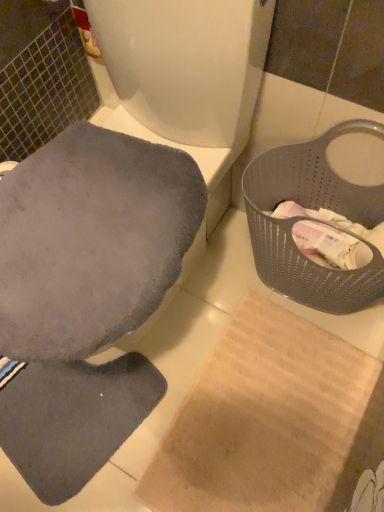
Question: From the image's perspective, is gray perforated basket at right on gray soft fabric toilet seat at upper left?

Choices:
 (A) no
 (B) yes

Answer: (A)

Question: Can you confirm if gray perforated basket at right is positioned to the left of gray soft fabric toilet seat at upper left?

Choices:
 (A) no
 (B) yes

Answer: (A)

Question: Considering the relative sizes of gray perforated basket at right and gray soft fabric toilet seat at upper left in the image provided, is gray perforated basket at right shorter than gray soft fabric toilet seat at upper left?

Choices:
 (A) no
 (B) yes

Answer: (B)

Question: Does gray perforated basket at right have a greater width compared to gray soft fabric toilet seat at upper left?

Choices:
 (A) no
 (B) yes

Answer: (A)

Question: Are gray perforated basket at right and gray soft fabric toilet seat at upper left far apart?

Choices:
 (A) no
 (B) yes

Answer: (A)

Question: From a real-world perspective, does gray perforated basket at right stand above gray soft fabric toilet seat at upper left?

Choices:
 (A) no
 (B) yes

Answer: (A)

Question: Would you say gray soft fabric toilet seat at upper left is outside gray perforated basket at right?

Choices:
 (A) yes
 (B) no

Answer: (A)

Question: Considering the relative sizes of gray soft fabric toilet seat at upper left and gray perforated basket at right in the image provided, is gray soft fabric toilet seat at upper left shorter than gray perforated basket at right?

Choices:
 (A) yes
 (B) no

Answer: (B)

Question: Is gray soft fabric toilet seat at upper left to the left of gray perforated basket at right from the viewer's perspective?

Choices:
 (A) no
 (B) yes

Answer: (B)

Question: From a real-world perspective, is gray soft fabric toilet seat at upper left under gray perforated basket at right?

Choices:
 (A) no
 (B) yes

Answer: (A)

Question: Is gray soft fabric toilet seat at upper left bigger than gray perforated basket at right?

Choices:
 (A) yes
 (B) no

Answer: (A)

Question: Is gray soft fabric toilet seat at upper left turned away from gray perforated basket at right?

Choices:
 (A) no
 (B) yes

Answer: (A)

Question: Looking at their shapes, would you say gray soft fabric toilet seat at upper left is wider or thinner than gray perforated basket at right?

Choices:
 (A) thin
 (B) wide

Answer: (B)